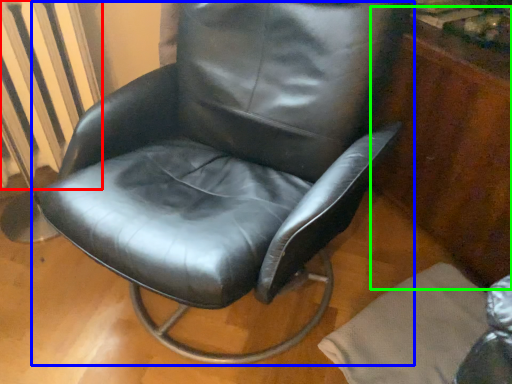
Question: Based on their relative distances, which object is farther from radiator (highlighted by a red box)? Choose from chair (highlighted by a blue box) and dresser (highlighted by a green box).

Choices:
 (A) chair
 (B) dresser

Answer: (B)